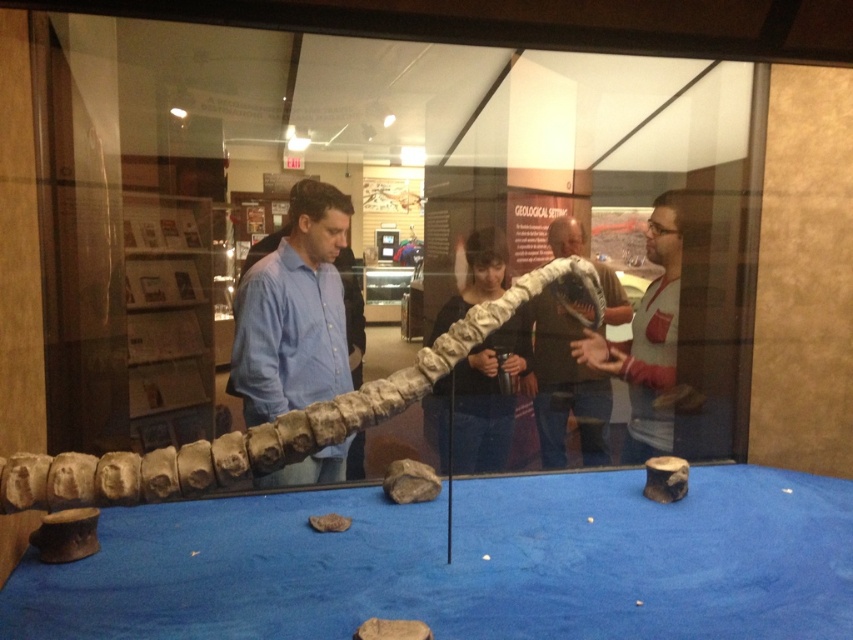
Question: Is matte gray dinosaur bone at center positioned behind matte gray dinosaur at center?

Choices:
 (A) yes
 (B) no

Answer: (B)

Question: Among these points, which one is nearest to the camera?

Choices:
 (A) (601, 419)
 (B) (479, 243)
 (C) (285, 314)

Answer: (C)

Question: Which object appears closest to the camera in this image?

Choices:
 (A) matte gray dinosaur at center
 (B) matte blue shirt at center
 (C) matte gray dinosaur bone at center

Answer: (B)

Question: Does matte blue shirt at center appear under matte gray dinosaur bone at center?

Choices:
 (A) yes
 (B) no

Answer: (A)

Question: Which object is the farthest from the matte blue shirt at center?

Choices:
 (A) matte white dinosaur bone at center
 (B) matte gray dinosaur bone at center

Answer: (B)

Question: Where is matte blue shirt at center located in relation to matte white dinosaur bone at center in the image?

Choices:
 (A) right
 (B) left

Answer: (B)